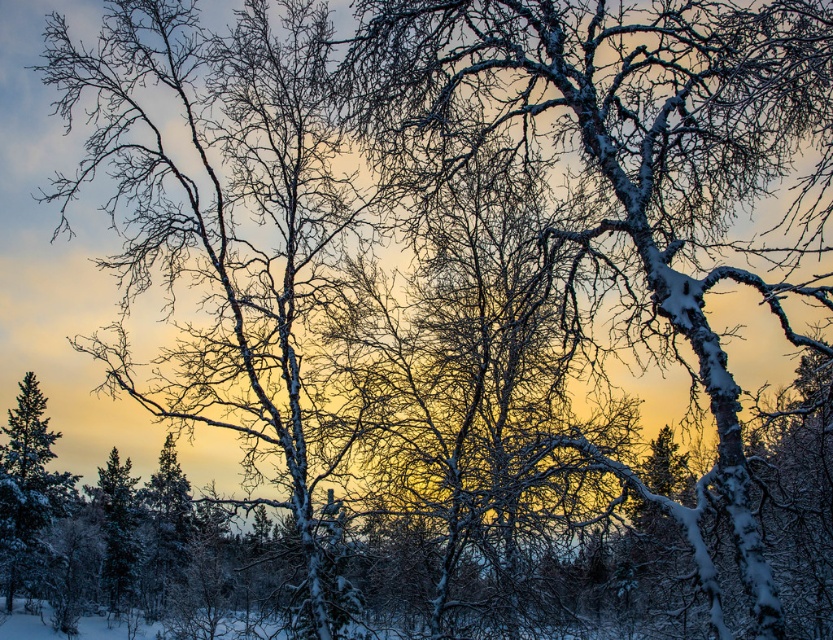
Does snow-covered branches at center have a lesser width compared to snow-covered birch tree at left?

Yes.

Who is shorter, snow-covered branches at center or snow-covered birch tree at left?

snow-covered branches at center

Who is more distant from viewer, (582,76) or (126,300)?

Point (126,300)

You are a GUI agent. You are given a task and a screenshot of the screen. Output one action in this format:
    pyautogui.click(x=<x>, y=<y>)
    Task: Click on the snow-covered branches at center
    
    Given the screenshot: What is the action you would take?
    pyautogui.click(x=626, y=166)